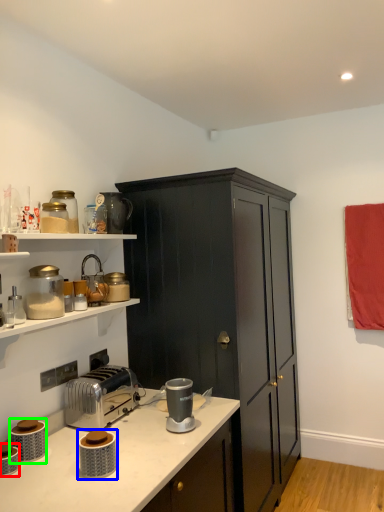
Question: Which is farther away from appliance (highlighted by a red box)? appliance (highlighted by a blue box) or appliance (highlighted by a green box)?

Choices:
 (A) appliance
 (B) appliance

Answer: (A)